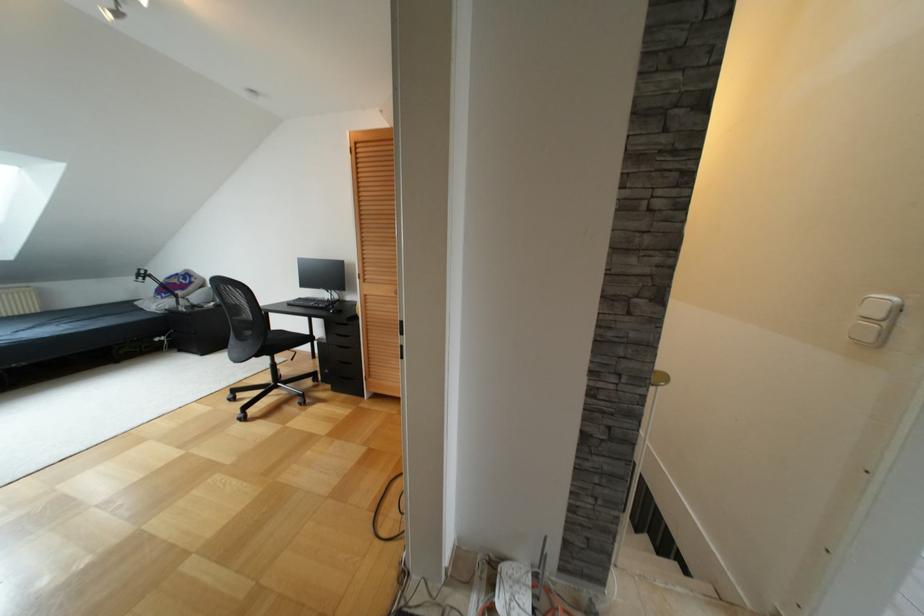
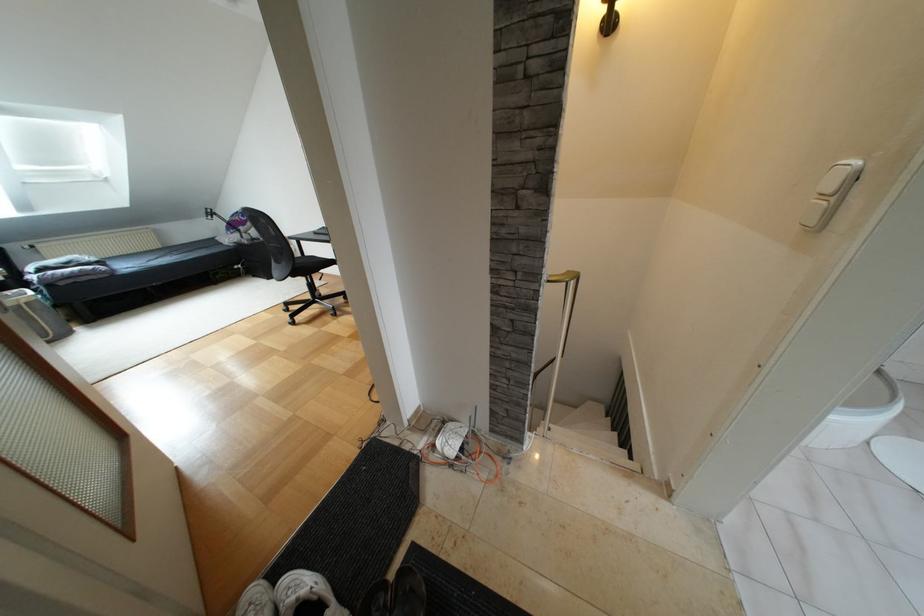
Where in the second image is the point corresponding to the point at 675,562 from the first image?

(624, 451)